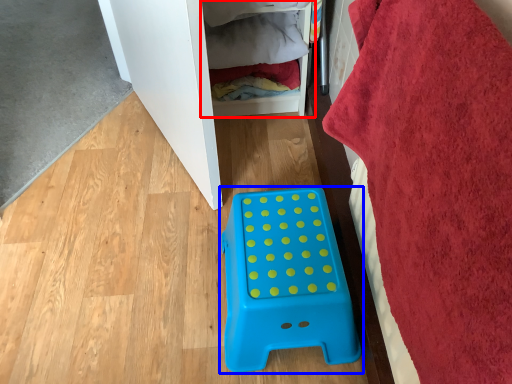
Question: Which object appears closest to the camera in this image, shelf (highlighted by a red box) or furniture (highlighted by a blue box)?

Choices:
 (A) shelf
 (B) furniture

Answer: (B)